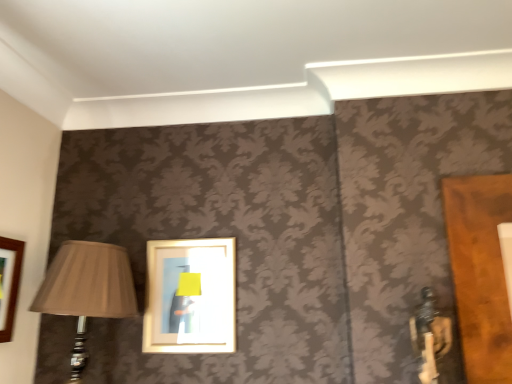
Describe the element at coordinates (190, 297) in the screenshot. The height and width of the screenshot is (384, 512). I see `wooden frame at center` at that location.

Locate an element on the screen. wooden frame at center is located at coordinates (190, 297).

Measure the distance between point (222,243) and camera.

A distance of 1.41 meters exists between point (222,243) and camera.

You are a GUI agent. You are given a task and a screenshot of the screen. Output one action in this format:
    pyautogui.click(x=<x>, y=<y>)
    Task: Click on the matte brown lampshade at left
    
    Given the screenshot: What is the action you would take?
    pyautogui.click(x=87, y=290)

This screenshot has width=512, height=384. What do you see at coordinates (87, 290) in the screenshot?
I see `matte brown lampshade at left` at bounding box center [87, 290].

What are the coordinates of `wooden frame at center` in the screenshot? It's located at (190, 297).

Which object is positioned more to the left, matte brown lampshade at left or wooden frame at center?

Positioned to the left is matte brown lampshade at left.

Which object is closer to the camera, matte brown lampshade at left or wooden frame at center?

matte brown lampshade at left is closer to the camera.

Which is behind, point (102, 303) or point (179, 347)?

The point (179, 347) is farther.

Based on the photo, from the image's perspective, which object appears higher, matte brown lampshade at left or wooden frame at center?

wooden frame at center, from the image's perspective.

From a real-world perspective, which object rests below the other?

matte brown lampshade at left.

Does matte brown lampshade at left have a lesser width compared to wooden frame at center?

No.

Can you confirm if matte brown lampshade at left is shorter than wooden frame at center?

Incorrect, the height of matte brown lampshade at left does not fall short of that of wooden frame at center.

Can you confirm if matte brown lampshade at left is smaller than wooden frame at center?

Incorrect, matte brown lampshade at left is not smaller in size than wooden frame at center.

Would you say matte brown lampshade at left contains wooden frame at center?

Definitely not — wooden frame at center is not inside matte brown lampshade at left.

Is matte brown lampshade at left directly adjacent to wooden frame at center?

They are not placed beside each other.

Is matte brown lampshade at left oriented away from wooden frame at center?

No, matte brown lampshade at left is not facing the opposite direction of wooden frame at center.

Find the location of a particular element. This screenshot has height=384, width=512. lamp lying below the wooden frame at center (from the image's perspective) is located at coordinates (87, 290).

Between wooden frame at center and matte brown lampshade at left, which one appears on the left side from the viewer's perspective?

matte brown lampshade at left.

Which object is closer to the camera, wooden frame at center or matte brown lampshade at left?

Positioned in front is matte brown lampshade at left.

Which is less distant, (169, 287) or (83, 277)?

Clearly, point (169, 287) is more distant from the camera than point (83, 277).

From the image's perspective, which one is positioned higher, wooden frame at center or matte brown lampshade at left?

wooden frame at center appears higher in the image.

From a real-world perspective, is wooden frame at center positioned under matte brown lampshade at left based on gravity?

No.

Does wooden frame at center have a greater width compared to matte brown lampshade at left?

No.

Considering the sizes of objects wooden frame at center and matte brown lampshade at left in the image provided, who is shorter, wooden frame at center or matte brown lampshade at left?

Standing shorter between the two is wooden frame at center.

Based on their sizes in the image, would you say wooden frame at center is bigger or smaller than matte brown lampshade at left?

Considering their sizes, wooden frame at center takes up less space than matte brown lampshade at left.

Do you think wooden frame at center is within matte brown lampshade at left, or outside of it?

wooden frame at center is not enclosed by matte brown lampshade at left.

Is wooden frame at center not near matte brown lampshade at left?

That's not correct — wooden frame at center is a little close to matte brown lampshade at left.

Is wooden frame at center turned away from matte brown lampshade at left?

wooden frame at center is not turned away from matte brown lampshade at left.

Can you tell me how much wooden frame at center and matte brown lampshade at left differ in facing direction?

The angular difference between wooden frame at center and matte brown lampshade at left is 1.52 degrees.

I want to click on picture frame above the matte brown lampshade at left (from the image's perspective), so pos(190,297).

The image size is (512, 384). In order to click on picture frame behind the matte brown lampshade at left in this screenshot , I will do `click(190, 297)`.

At what (x,y) coordinates should I click in order to perform the action: click on picture frame above the matte brown lampshade at left (from a real-world perspective). Please return your answer as a coordinate pair (x, y). The height and width of the screenshot is (384, 512). Looking at the image, I should click on (190, 297).